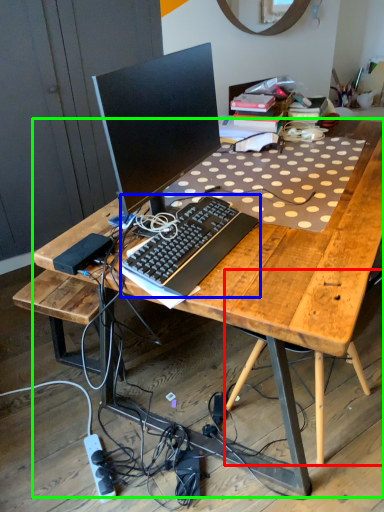
Question: Considering the real-world distances, which object is closest to computer chair (highlighted by a red box)? computer keyboard (highlighted by a blue box) or desk (highlighted by a green box).

Choices:
 (A) computer keyboard
 (B) desk

Answer: (B)